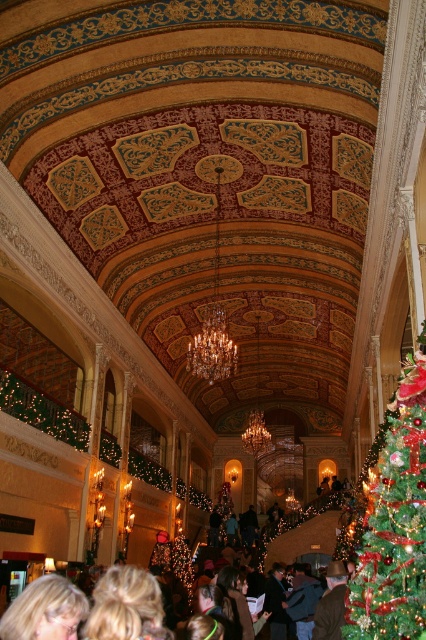
Question: Estimate the real-world distances between objects in this image. Which object is closer to the green shiny christmas tree at center?

Choices:
 (A) blonde hair at lower left
 (B) brown leather jacket at center

Answer: (B)

Question: Is green shiny christmas tree at center positioned in front of brown leather jacket at center?

Choices:
 (A) no
 (B) yes

Answer: (B)

Question: Can you confirm if blonde hair at lower left is positioned to the right of brown leather jacket at center?

Choices:
 (A) no
 (B) yes

Answer: (A)

Question: Among these points, which one is farthest from the camera?

Choices:
 (A) (97, 624)
 (B) (417, 538)

Answer: (A)

Question: Is blonde hair at lower left below brown leather jacket at center?

Choices:
 (A) yes
 (B) no

Answer: (A)

Question: Which object is farther from the camera taking this photo?

Choices:
 (A) green shiny christmas tree at center
 (B) blonde hair at lower left
 (C) brown leather jacket at center

Answer: (C)